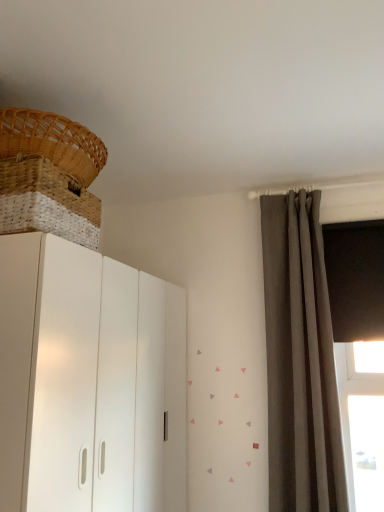
Where is `woven wood basket at upper left, positioned as the 1th basket in top-to-bottom order`? This screenshot has height=512, width=384. woven wood basket at upper left, positioned as the 1th basket in top-to-bottom order is located at coordinates (52, 142).

Locate an element on the screen. matte gray curtain at right is located at coordinates [300, 360].

Where is `woven wood basket at upper left, positioned as the 1th basket in top-to-bottom order`? The height and width of the screenshot is (512, 384). woven wood basket at upper left, positioned as the 1th basket in top-to-bottom order is located at coordinates [52, 142].

Measure the distance between matte gray curtain at right and woven wood basket at upper left, the 2th basket from the top.

A distance of 1.19 meters exists between matte gray curtain at right and woven wood basket at upper left, the 2th basket from the top.

How many degrees apart are the facing directions of matte gray curtain at right and woven wood basket at upper left, which is the first basket in bottom-to-top order?

There is a 90.8-degree angle between the facing directions of matte gray curtain at right and woven wood basket at upper left, which is the first basket in bottom-to-top order.

Between point (272, 443) and point (6, 177), which one is positioned in front?

The point (6, 177) is in front.

Which is behind, matte gray curtain at right or woven wood basket at upper left, which is the first basket in bottom-to-top order?

matte gray curtain at right is more distant.

Is woven wood basket at upper left, the 2th basket from the top, to the right of matte gray curtain at right from the viewer's perspective?

No, woven wood basket at upper left, the 2th basket from the top, is not to the right of matte gray curtain at right.

Is the depth of woven wood basket at upper left, which is the first basket in bottom-to-top order, greater than that of matte gray curtain at right?

That is False.

Does woven wood basket at upper left, which is the first basket in bottom-to-top order, have a larger size compared to matte gray curtain at right?

Actually, woven wood basket at upper left, which is the first basket in bottom-to-top order, might be smaller than matte gray curtain at right.

Could you tell me if woven wood basket at upper left, the 2th basket from the top, is turned towards matte gray curtain at right?

No, woven wood basket at upper left, the 2th basket from the top, is not turned towards matte gray curtain at right.

In the scene shown: Choose the correct answer: Is matte gray curtain at right inside white matte cupboard at left or outside it?

matte gray curtain at right lies outside white matte cupboard at left.

From the image's perspective, between matte gray curtain at right and white matte cupboard at left, which one is located above?

matte gray curtain at right is shown above in the image.

From a real-world perspective, is matte gray curtain at right over white matte cupboard at left?

Correct, in the physical world, matte gray curtain at right is higher than white matte cupboard at left.

Consider the image. Between white matte cupboard at left and matte gray curtain at right, which one has more height?

matte gray curtain at right.

Is there a large distance between white matte cupboard at left and matte gray curtain at right?

No, there isn't a large distance between white matte cupboard at left and matte gray curtain at right.

Which object is positioned more to the right, white matte cupboard at left or matte gray curtain at right?

Positioned to the right is matte gray curtain at right.

The image size is (384, 512). In order to click on curtain positioned vertically above the white matte cupboard at left (from a real-world perspective) in this screenshot , I will do `click(300, 360)`.

Is woven wood basket at upper left, the 2th basket from the top, positioned with its back to white matte cupboard at left?

No, woven wood basket at upper left, the 2th basket from the top, is not facing the opposite direction of white matte cupboard at left.

Which is more to the right, woven wood basket at upper left, which is the first basket in bottom-to-top order, or white matte cupboard at left?

white matte cupboard at left.

Are woven wood basket at upper left, the 2th basket from the top, and white matte cupboard at left far apart?

No, woven wood basket at upper left, the 2th basket from the top, is not far away from white matte cupboard at left.

In terms of size, does woven wood basket at upper left, which is the first basket in bottom-to-top order, appear bigger or smaller than white matte cupboard at left?

woven wood basket at upper left, which is the first basket in bottom-to-top order, is smaller than white matte cupboard at left.

From the image's perspective, is white matte cupboard at left beneath woven wood basket at upper left, which is the first basket in bottom-to-top order?

Indeed, from the image's perspective, white matte cupboard at left is shown beneath woven wood basket at upper left, which is the first basket in bottom-to-top order.

Is white matte cupboard at left not inside woven wood basket at upper left, the 2th basket from the top?

Absolutely, white matte cupboard at left is external to woven wood basket at upper left, the 2th basket from the top.

Is white matte cupboard at left far from woven wood basket at upper left, which is the first basket in bottom-to-top order?

That's not correct — white matte cupboard at left is a little close to woven wood basket at upper left, which is the first basket in bottom-to-top order.

Considering the points (15, 414) and (42, 201), which point is in front, point (15, 414) or point (42, 201)?

Point (15, 414)

Is white matte cupboard at left at the back of woven wood basket at upper left, marked as the second basket in a bottom-to-top arrangement?

That's not correct — woven wood basket at upper left, marked as the second basket in a bottom-to-top arrangement, is not looking away from white matte cupboard at left.

Which object is positioned more to the left, woven wood basket at upper left, positioned as the 1th basket in top-to-bottom order, or white matte cupboard at left?

woven wood basket at upper left, positioned as the 1th basket in top-to-bottom order, is more to the left.

Is woven wood basket at upper left, positioned as the 1th basket in top-to-bottom order, located outside white matte cupboard at left?

Yes, woven wood basket at upper left, positioned as the 1th basket in top-to-bottom order, is outside of white matte cupboard at left.

The width and height of the screenshot is (384, 512). I want to click on curtain that appears on the right of woven wood basket at upper left, the 2th basket from the top, so click(x=300, y=360).

Where is `curtain that appears behind the woven wood basket at upper left, which is the first basket in bottom-to-top order`? The width and height of the screenshot is (384, 512). curtain that appears behind the woven wood basket at upper left, which is the first basket in bottom-to-top order is located at coordinates (300, 360).

Considering their positions, is matte gray curtain at right positioned closer to woven wood basket at upper left, which is the first basket in bottom-to-top order, than white matte cupboard at left?

white matte cupboard at left lies closer to woven wood basket at upper left, which is the first basket in bottom-to-top order, than the other object.

Looking at the image, which one is located further to woven wood basket at upper left, positioned as the 1th basket in top-to-bottom order, white matte cupboard at left or woven wood basket at upper left, which is the first basket in bottom-to-top order?

white matte cupboard at left is further to woven wood basket at upper left, positioned as the 1th basket in top-to-bottom order.

Looking at the image, which one is located further to white matte cupboard at left, woven wood basket at upper left, marked as the second basket in a bottom-to-top arrangement, or woven wood basket at upper left, which is the first basket in bottom-to-top order?

woven wood basket at upper left, marked as the second basket in a bottom-to-top arrangement, is further to white matte cupboard at left.

Which object lies further to the anchor point white matte cupboard at left, matte gray curtain at right or woven wood basket at upper left, which is the first basket in bottom-to-top order?

matte gray curtain at right lies further to white matte cupboard at left than the other object.

From the image, which object appears to be nearer to matte gray curtain at right, woven wood basket at upper left, positioned as the 1th basket in top-to-bottom order, or woven wood basket at upper left, the 2th basket from the top?

Among the two, woven wood basket at upper left, the 2th basket from the top, is located nearer to matte gray curtain at right.

Consider the image. Based on their spatial positions, is matte gray curtain at right or woven wood basket at upper left, the 2th basket from the top, further from woven wood basket at upper left, positioned as the 1th basket in top-to-bottom order?

matte gray curtain at right.

Looking at the image, which one is located further to woven wood basket at upper left, which is the first basket in bottom-to-top order, woven wood basket at upper left, marked as the second basket in a bottom-to-top arrangement, or matte gray curtain at right?

matte gray curtain at right is positioned further to the anchor woven wood basket at upper left, which is the first basket in bottom-to-top order.

Looking at the image, which one is located further to white matte cupboard at left, woven wood basket at upper left, the 2th basket from the top, or matte gray curtain at right?

matte gray curtain at right is further to white matte cupboard at left.

You are a GUI agent. You are given a task and a screenshot of the screen. Output one action in this format:
    pyautogui.click(x=<x>, y=<y>)
    Task: Click on the cupboard situated between woven wood basket at upper left, which is the first basket in bottom-to-top order, and matte gray curtain at right from left to right
    The width and height of the screenshot is (384, 512).
    Given the screenshot: What is the action you would take?
    pyautogui.click(x=89, y=381)

Locate an element on the screen. The image size is (384, 512). cupboard between woven wood basket at upper left, positioned as the 1th basket in top-to-bottom order, and matte gray curtain at right from left to right is located at coordinates (89, 381).

Identify the location of basket between woven wood basket at upper left, marked as the second basket in a bottom-to-top arrangement, and matte gray curtain at right. (47, 202).

The image size is (384, 512). I want to click on basket that lies between woven wood basket at upper left, positioned as the 1th basket in top-to-bottom order, and white matte cupboard at left from top to bottom, so click(47, 202).